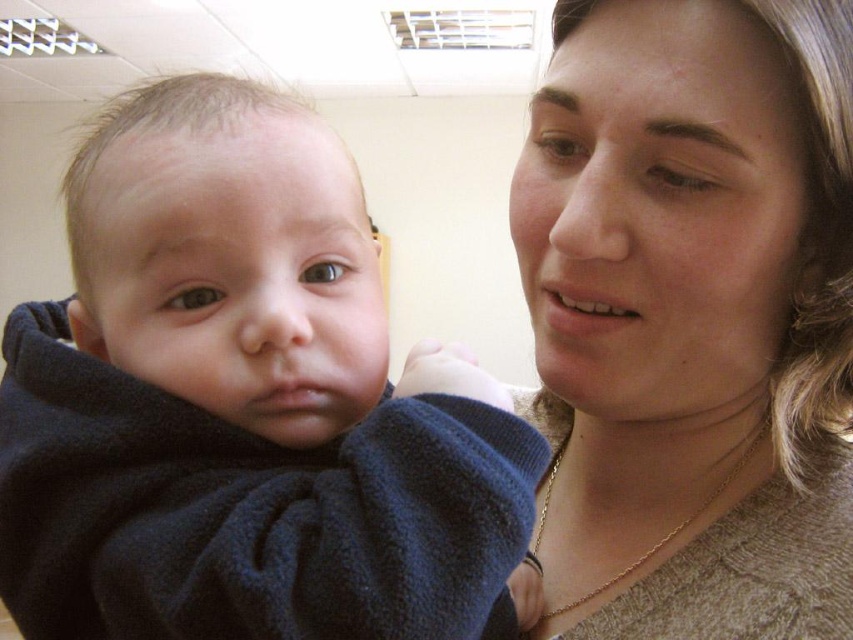
You are a photographer trying to focus on the two points in the image. Which point, point (138, 337) or point (811, 563), is closer to you?

Point (138, 337) is closer to the viewer than point (811, 563).